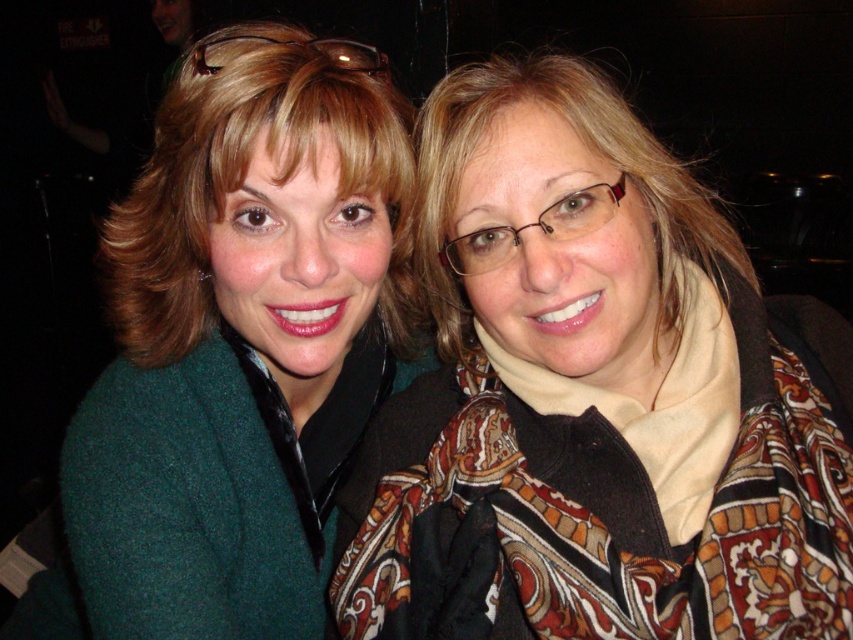
Question: Among these points, which one is nearest to the camera?

Choices:
 (A) (686, 204)
 (B) (838, 426)
 (C) (207, 320)

Answer: (B)

Question: Which object is the farthest from the green woolen sweater at upper left?

Choices:
 (A) matte brown scarf at right
 (B) matte green sweater at upper left
 (C) paisley-patterned scarf at center

Answer: (C)

Question: Estimate the real-world distances between objects in this image. Which object is farther from the paisley-patterned scarf at center?

Choices:
 (A) matte brown scarf at right
 (B) matte green sweater at upper left
 (C) green woolen sweater at upper left

Answer: (B)

Question: Is green woolen sweater at upper left positioned before matte brown scarf at right?

Choices:
 (A) yes
 (B) no

Answer: (B)

Question: In this image, where is green woolen sweater at upper left located relative to matte brown scarf at right?

Choices:
 (A) right
 (B) left

Answer: (B)

Question: Does green woolen sweater at upper left have a lesser width compared to matte brown scarf at right?

Choices:
 (A) yes
 (B) no

Answer: (A)